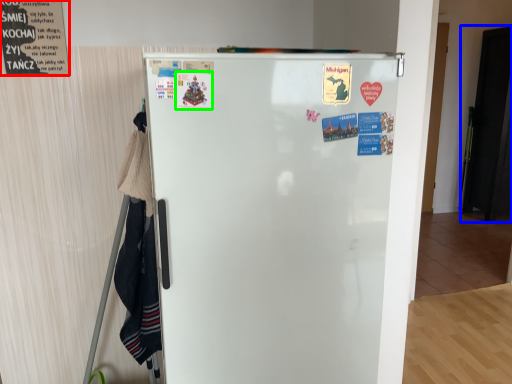
Question: Which object is positioned closest to poster (highlighted by a red box)? Select from door (highlighted by a blue box) and poster (highlighted by a green box).

Choices:
 (A) door
 (B) poster

Answer: (B)